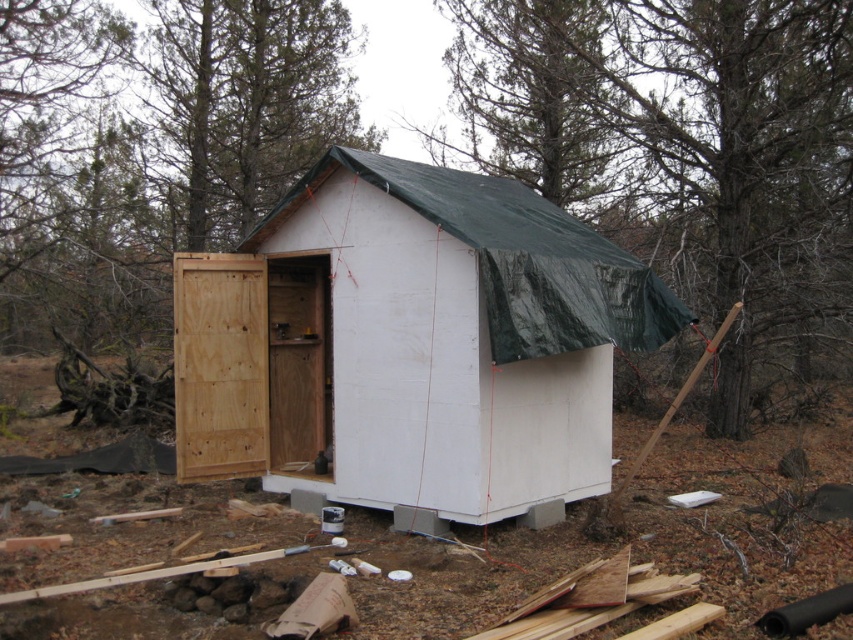
Question: Which object is farther from the camera taking this photo?

Choices:
 (A) green tarp at upper center
 (B) white wood cabin at center

Answer: (A)

Question: Which of the following is the farthest from the observer?

Choices:
 (A) white wood cabin at center
 (B) green tarp at upper center

Answer: (B)

Question: Can you confirm if white wood cabin at center is positioned to the left of green tarp at upper center?

Choices:
 (A) yes
 (B) no

Answer: (A)

Question: Does white wood cabin at center appear on the left side of green tarp at upper center?

Choices:
 (A) no
 (B) yes

Answer: (B)

Question: Is white wood cabin at center thinner than green tarp at upper center?

Choices:
 (A) yes
 (B) no

Answer: (B)